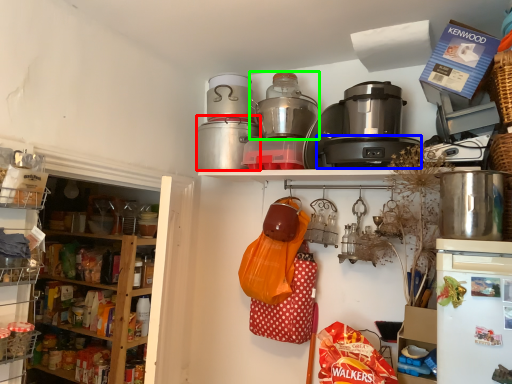
Question: Which object is the closest to the crock pot (highlighted by a red box)? Choose among these: appliance (highlighted by a blue box) or rice cooker (highlighted by a green box).

Choices:
 (A) appliance
 (B) rice cooker

Answer: (B)